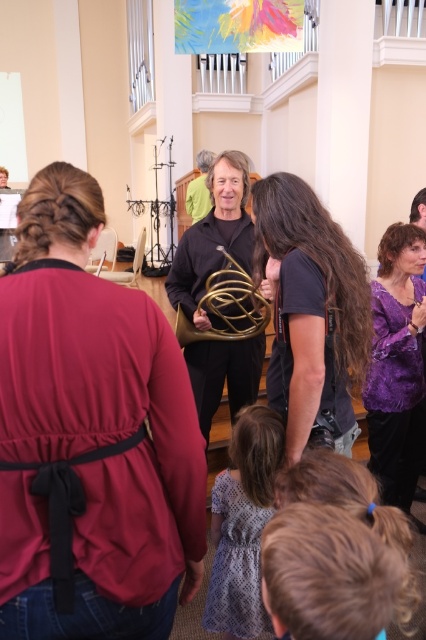
Question: Can you confirm if matte red blouse at center is wider than printed fabric dress at lower center?

Choices:
 (A) yes
 (B) no

Answer: (A)

Question: Can you confirm if matte red blouse at center is thinner than purple satin blouse at upper right?

Choices:
 (A) no
 (B) yes

Answer: (B)

Question: Which object is farther from the camera taking this photo?

Choices:
 (A) gold brass trumpet at center
 (B) black t-shirt at center
 (C) purple satin blouse at upper right

Answer: (C)

Question: Which point is farther from the camera taking this photo?

Choices:
 (A) (36, 276)
 (B) (397, 269)
 (C) (294, 426)
 (D) (244, 296)

Answer: (B)

Question: Among these points, which one is nearest to the camera?

Choices:
 (A) pos(98,454)
 (B) pos(405,476)
 (C) pos(232,493)
 (D) pos(239,273)

Answer: (A)

Question: Can you confirm if matte red blouse at center is positioned below black t-shirt at center?

Choices:
 (A) no
 (B) yes

Answer: (B)